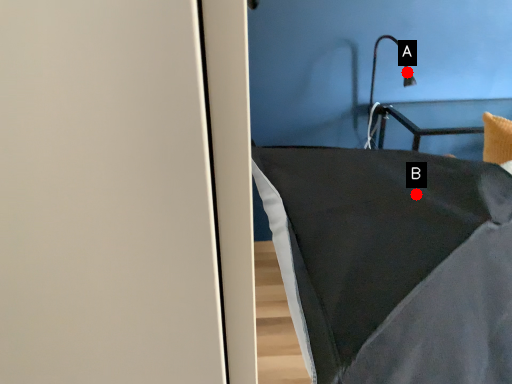
Question: Two points are circled on the image, labeled by A and B beside each circle. Which point is closer to the camera?

Choices:
 (A) A is closer
 (B) B is closer

Answer: (B)